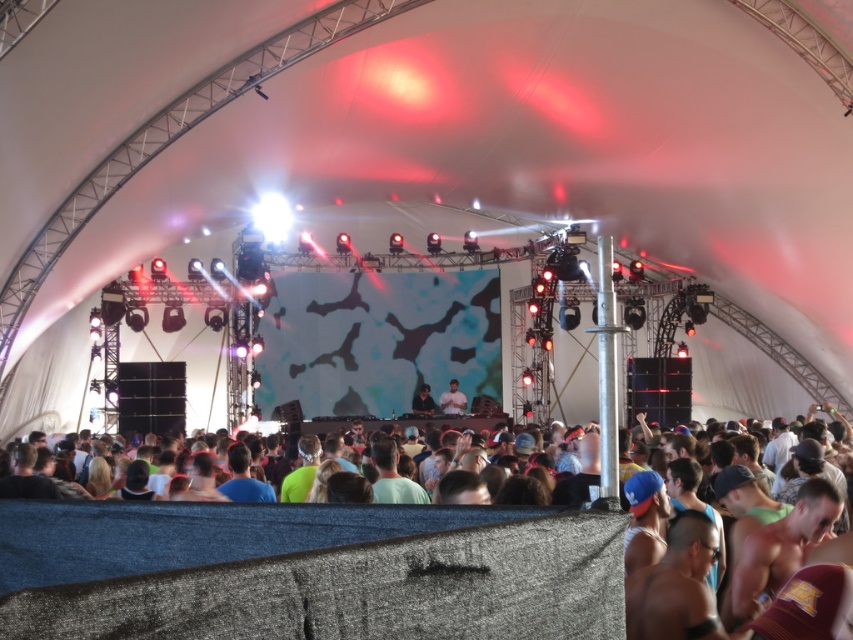
Between light beige fabric at center and matte black dj booth at center, which one is positioned lower?

matte black dj booth at center is below.

Who is positioned more to the right, light beige fabric at center or matte black dj booth at center?

From the viewer's perspective, light beige fabric at center appears more on the right side.

What do you see at coordinates (451, 400) in the screenshot? This screenshot has height=640, width=853. I see `light beige fabric at center` at bounding box center [451, 400].

Identify the location of light beige fabric at center. (451, 400).